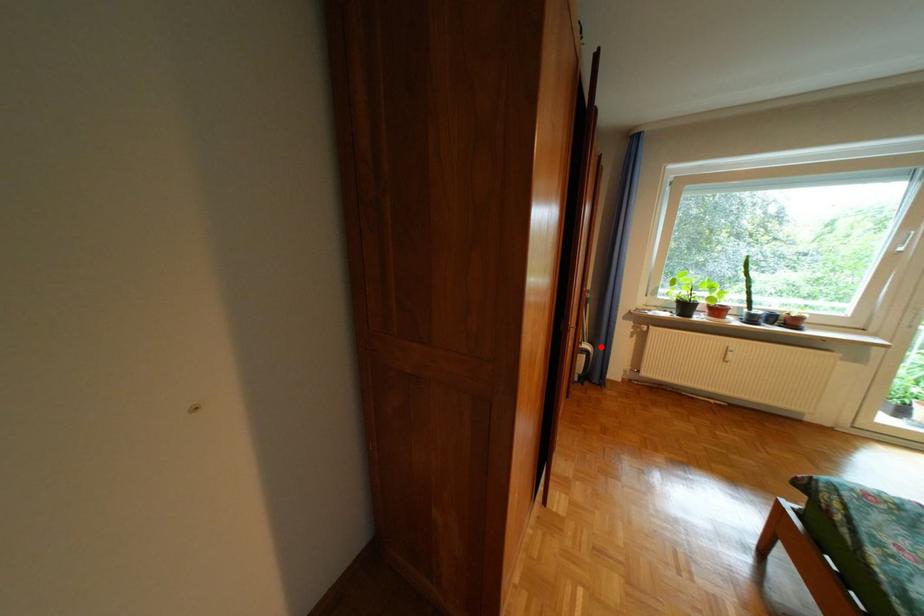
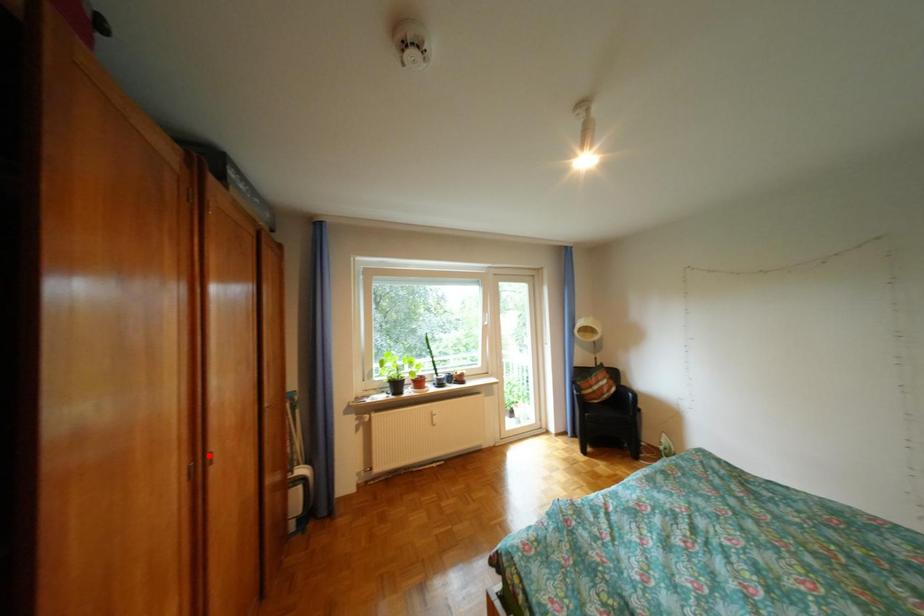
Consider the image. I am providing you with two images of the same scene from different viewpoints. A red point is marked on the first image and another point is marked on the second image. Is the marked point in image1 the same physical position as the marked point in image2?

No